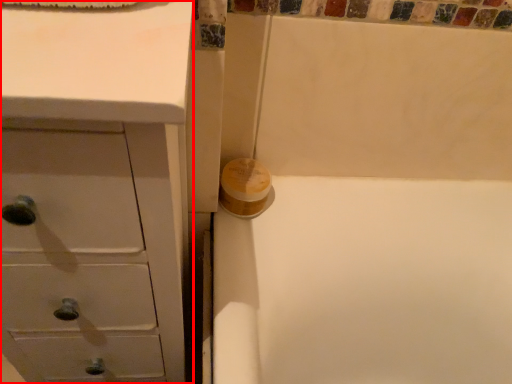
Question: From the image's perspective, what is the correct spatial relationship of chest of drawers (annotated by the red box) in relation to toilet paper?

Choices:
 (A) above
 (B) below

Answer: (B)